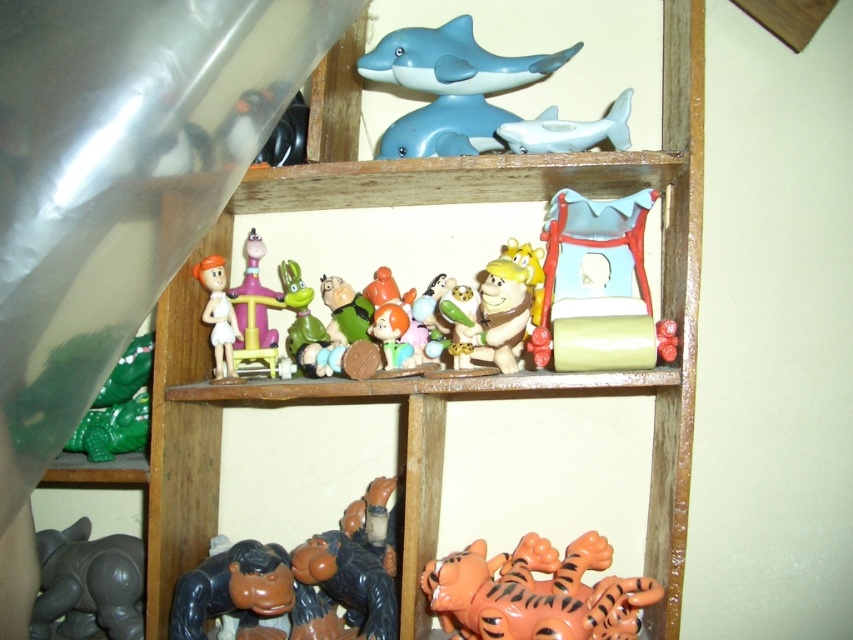
Does matte plastic bed at center appear on the right side of white glossy figurine at center?

Yes, matte plastic bed at center is to the right of white glossy figurine at center.

Locate an element on the screen. Image resolution: width=853 pixels, height=640 pixels. matte plastic bed at center is located at coordinates (599, 288).

Between point (584, 154) and point (247, 246), which one is positioned in front?

Point (584, 154) is more forward.

Does matte plastic toys at upper center have a lesser height compared to matte plastic toy at center?

In fact, matte plastic toys at upper center may be taller than matte plastic toy at center.

Which is in front, point (650, 472) or point (251, 310)?

Point (650, 472) is in front.

Identify the location of matte plastic toys at upper center. (442, 381).

Is matte plastic toys at upper center wider than green matte toy at lower left?

Yes, matte plastic toys at upper center is wider than green matte toy at lower left.

Does matte plastic toys at upper center come behind green matte toy at lower left?

No, it is not.

Between point (241, 192) and point (132, 408), which one is positioned behind?

Point (132, 408)

The height and width of the screenshot is (640, 853). What are the coordinates of `matte plastic toys at upper center` in the screenshot? It's located at (442, 381).